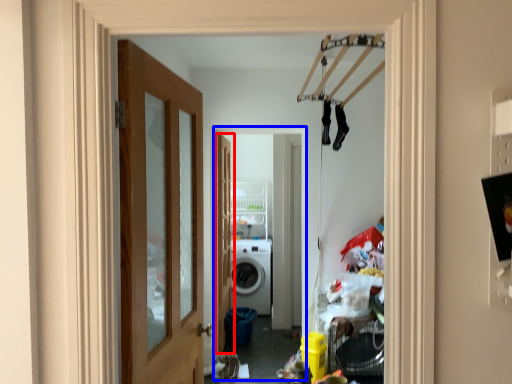
Question: Which object appears closest to the camera in this image, door (highlighted by a red box) or corridor (highlighted by a blue box)?

Choices:
 (A) door
 (B) corridor

Answer: (B)